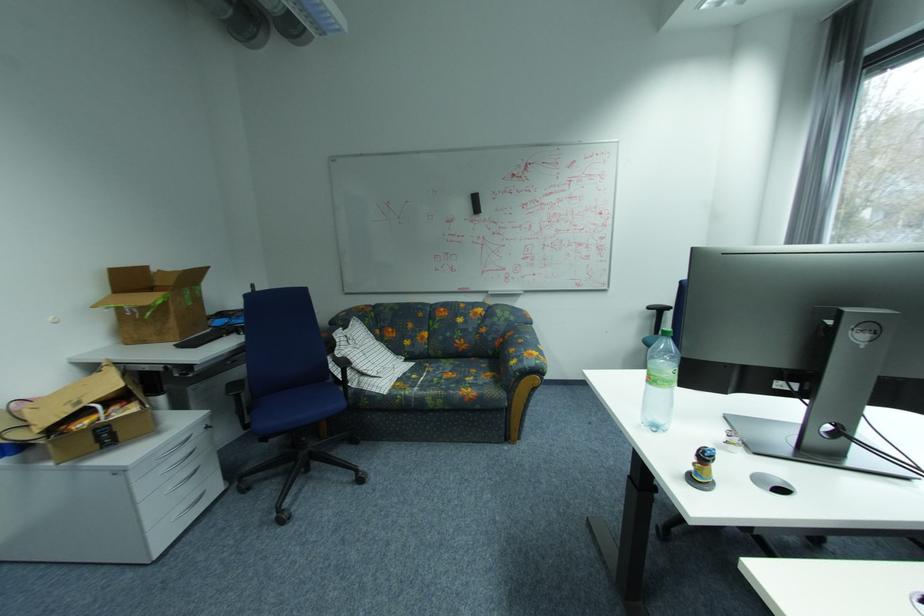
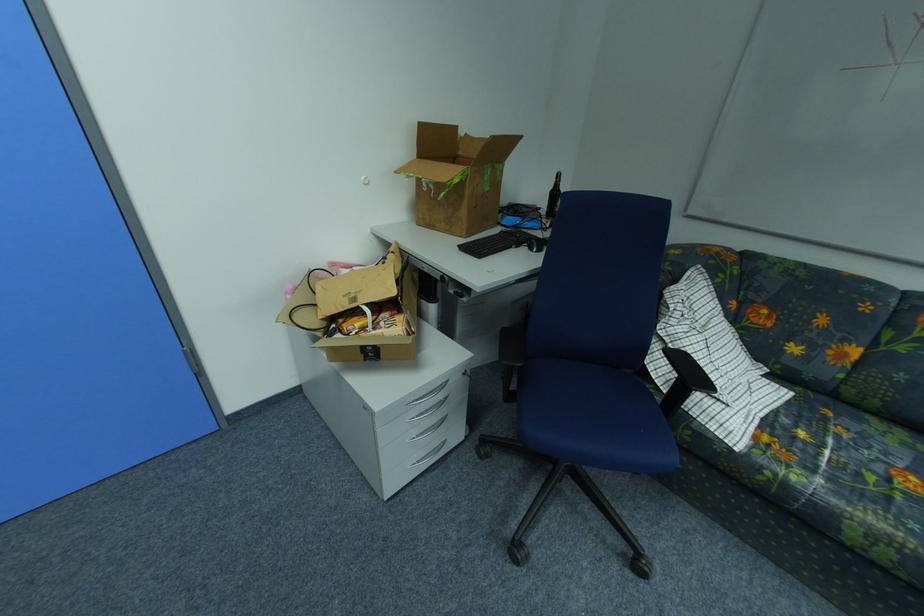
In the second image, find the point that corresponds to pixel 416 392 in the first image.

(804, 479)